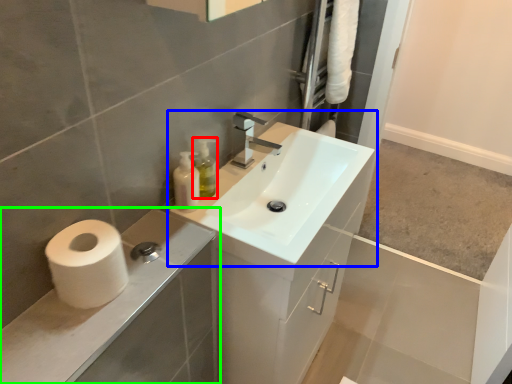
Question: Based on their relative distances, which object is nearer to soap dispenser (highlighted by a red box)? Choose from sink (highlighted by a blue box) and bathroom cabinet (highlighted by a green box).

Choices:
 (A) sink
 (B) bathroom cabinet

Answer: (A)